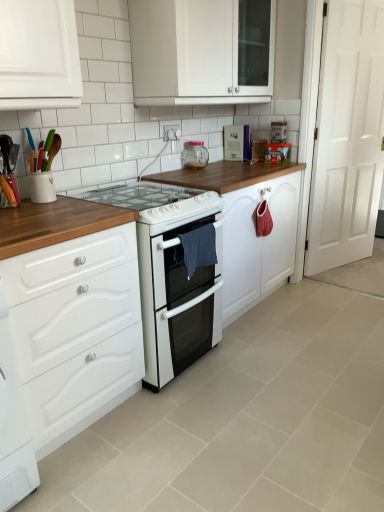
Question: From a real-world perspective, is white wooden door at right positioned above or below white glossy gas stove at center?

Choices:
 (A) above
 (B) below

Answer: (A)

Question: Is white wooden door at right taller or shorter than white glossy gas stove at center?

Choices:
 (A) short
 (B) tall

Answer: (B)

Question: Estimate the real-world distances between objects in this image. Which object is closer to the white wooden door at right?

Choices:
 (A) metallic silver book at upper center, marked as the 1th appliance in a right-to-left arrangement
 (B) white glossy cabinet at lower left, the first cabinetry when ordered from bottom to top
 (C) clear glass jar at upper center, which is the 2th appliance in bottom-to-top order
 (D) white glossy electric stove at center, marked as the first appliance in a left-to-right arrangement
 (E) white glossy cabinet at upper center, which is the 1th cabinetry in top-to-bottom order

Answer: (A)

Question: Based on their relative distances, which object is farther from the metallic silver book at upper center, the first appliance when ordered from top to bottom?

Choices:
 (A) white glossy cabinet at lower left, the first cabinetry when ordered from bottom to top
 (B) clear glass jar at upper center, arranged as the second appliance when viewed from the right
 (C) white glossy gas stove at center
 (D) white glossy electric stove at center, positioned as the 3th appliance in top-to-bottom order
 (E) white wooden door at right

Answer: (D)